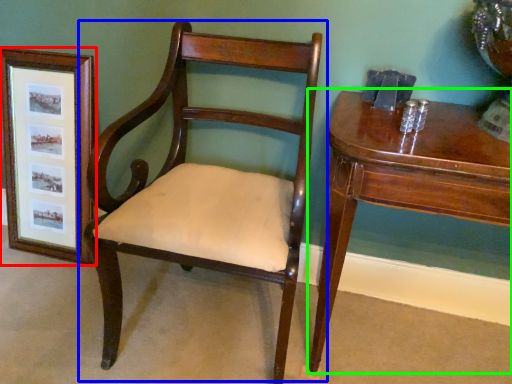
Question: Considering the real-world distances, which object is closest to picture frame (highlighted by a red box)? chair (highlighted by a blue box) or table (highlighted by a green box).

Choices:
 (A) chair
 (B) table

Answer: (A)